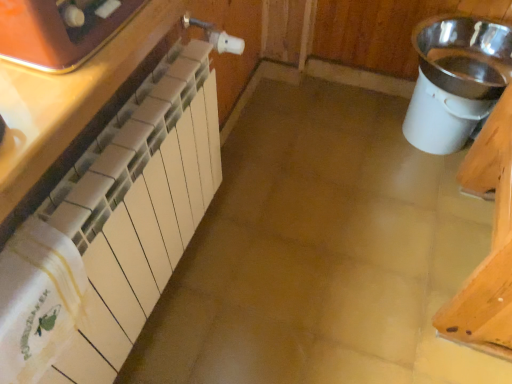
Question: Should I look upward or downward to see matte white radiator at left, the 1th cabinetry from the back?

Choices:
 (A) up
 (B) down

Answer: (B)

Question: Is silver metallic sink at right positioned beyond the bounds of matte white radiator at left, the second cabinetry positioned from the front?

Choices:
 (A) yes
 (B) no

Answer: (A)

Question: Would you consider silver metallic sink at right to be distant from matte white radiator at left, the second cabinetry positioned from the front?

Choices:
 (A) no
 (B) yes

Answer: (B)

Question: Is silver metallic sink at right at the left side of matte white radiator at left, the 1th cabinetry from the back?

Choices:
 (A) yes
 (B) no

Answer: (B)

Question: From a real-world perspective, is silver metallic sink at right located beneath matte white radiator at left, the 1th cabinetry from the back?

Choices:
 (A) no
 (B) yes

Answer: (B)

Question: From a real-world perspective, is silver metallic sink at right positioned over matte white radiator at left, the 1th cabinetry from the back, based on gravity?

Choices:
 (A) no
 (B) yes

Answer: (A)

Question: Can you confirm if silver metallic sink at right is thinner than matte white radiator at left, the second cabinetry positioned from the front?

Choices:
 (A) no
 (B) yes

Answer: (A)

Question: Considering the relative sizes of silver metallic sink at right and matte orange toaster at upper left in the image provided, is silver metallic sink at right wider than matte orange toaster at upper left?

Choices:
 (A) yes
 (B) no

Answer: (A)

Question: Does silver metallic sink at right appear on the right side of matte orange toaster at upper left?

Choices:
 (A) yes
 (B) no

Answer: (A)

Question: Would you say silver metallic sink at right contains matte orange toaster at upper left?

Choices:
 (A) no
 (B) yes

Answer: (A)

Question: From a real-world perspective, is silver metallic sink at right physically below matte orange toaster at upper left?

Choices:
 (A) no
 (B) yes

Answer: (B)

Question: Is silver metallic sink at right positioned far away from matte orange toaster at upper left?

Choices:
 (A) no
 (B) yes

Answer: (B)

Question: Is the surface of silver metallic sink at right in direct contact with matte orange toaster at upper left?

Choices:
 (A) yes
 (B) no

Answer: (B)

Question: Is matte white radiator at left, the second cabinetry positioned from the front, to the left of matte orange toaster at upper left from the viewer's perspective?

Choices:
 (A) no
 (B) yes

Answer: (A)